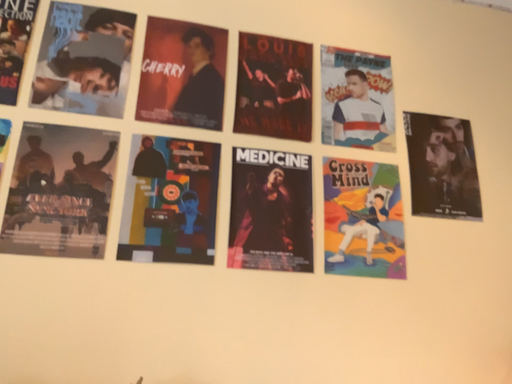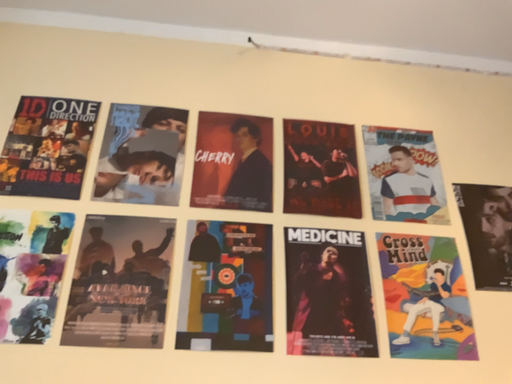
Question: Which way did the camera rotate in the video?

Choices:
 (A) rotated upward
 (B) rotated downward

Answer: (A)